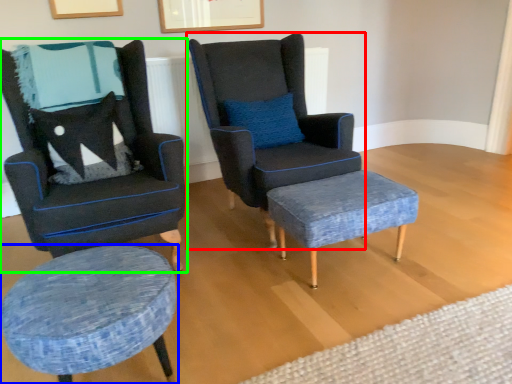
Question: Estimate the real-world distances between objects in this image. Which object is closer to chair (highlighted by a red box), stool (highlighted by a blue box) or chair (highlighted by a green box)?

Choices:
 (A) stool
 (B) chair

Answer: (B)